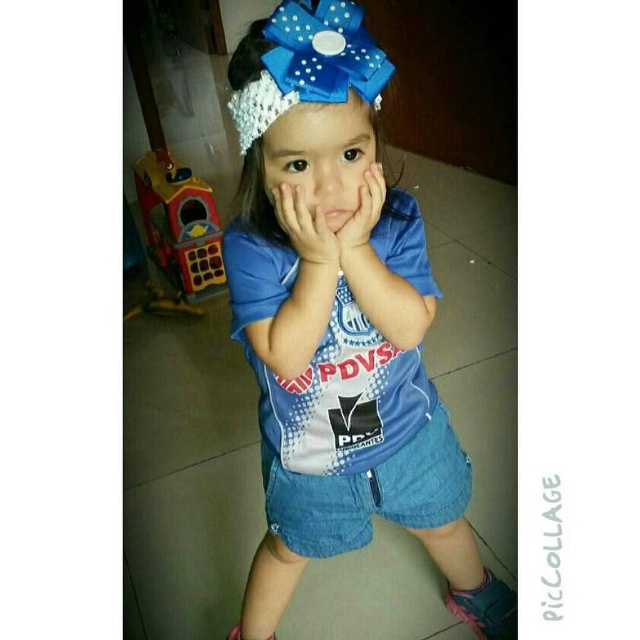
You are a photographer trying to capture a closeup of the child in the image. The camera is set to focus on objects exactly 25.40 inches away. Will the point at coordinates point (324,154) be in focus?

The point at coordinates point (324,154) is 25.40 inches away from the camera, so it will be in focus.

You are a photographer adjusting your camera to focus on the blue satin bow at upper center and the matte blue bow at center. Which bow should you focus on first to ensure it appears sharp in the photo?

You should focus on the blue satin bow at upper center first because it is closer to the viewer than the matte blue bow at center, so it requires proper focus adjustment before the other.

You are a toy designer observing the child in the image. You need to determine if the matte plastic toy at left can be placed on a shelf that is the same height as the denim shorts at center. Can it fit?

The denim shorts at center is not as tall as matte plastic toy at left, so the matte plastic toy at left cannot fit on a shelf that is the same height as the denim shorts at center because it is taller.